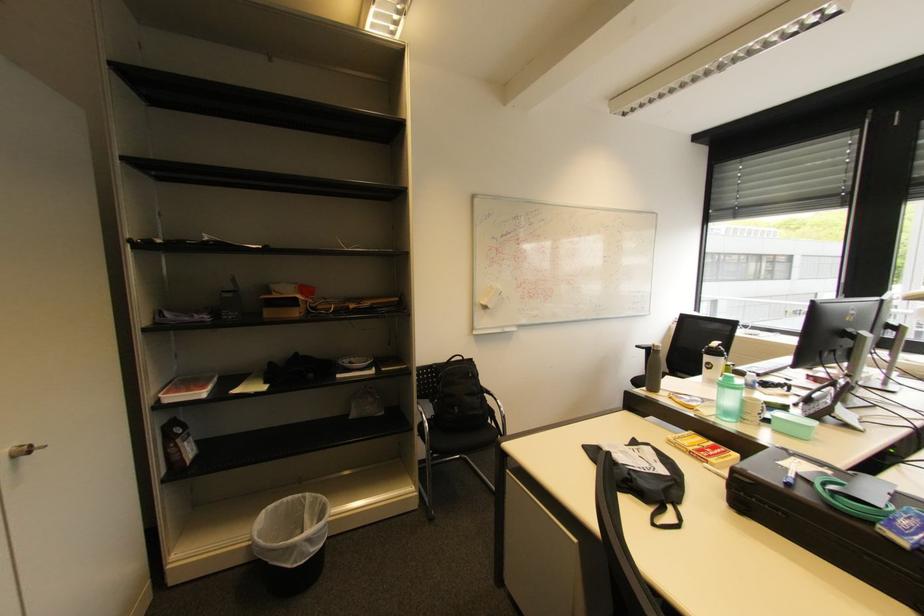
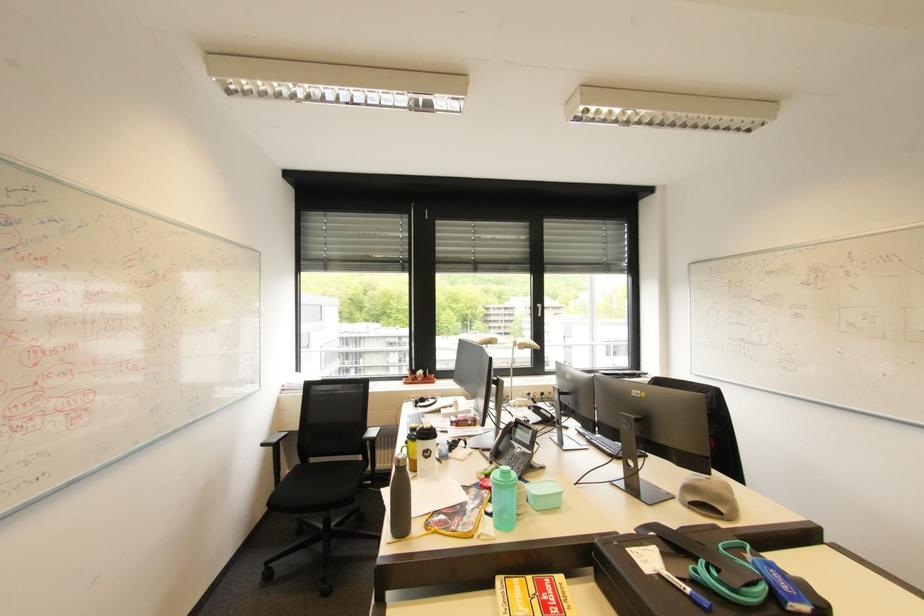
The point at (804, 477) is marked in the first image. Where is the corresponding point in the second image?

(685, 581)